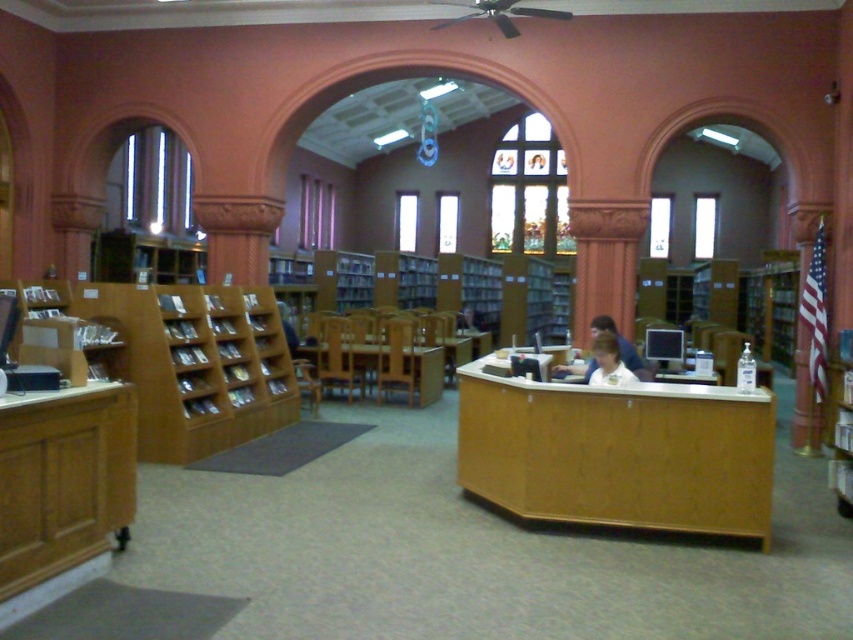
Question: Among these objects, which one is nearest to the camera?

Choices:
 (A) wooden desk at center
 (B) white shirt at center
 (C) light brown wooden desk at center

Answer: (A)

Question: Which point is farther to the camera?

Choices:
 (A) (610, 340)
 (B) (839, 461)
 (C) (357, 360)

Answer: (C)

Question: Is wooden desk at lower left above wooden bookshelf at right?

Choices:
 (A) no
 (B) yes

Answer: (B)

Question: Is wooden desk at lower left further to camera compared to light brown wooden desk at center?

Choices:
 (A) yes
 (B) no

Answer: (B)

Question: Does wooden bookshelf at left have a smaller size compared to light brown wooden desk at center?

Choices:
 (A) no
 (B) yes

Answer: (A)

Question: Which of these objects is positioned farthest from the light brown wooden desk at center?

Choices:
 (A) wooden desk at lower left
 (B) wooden desk at center

Answer: (A)